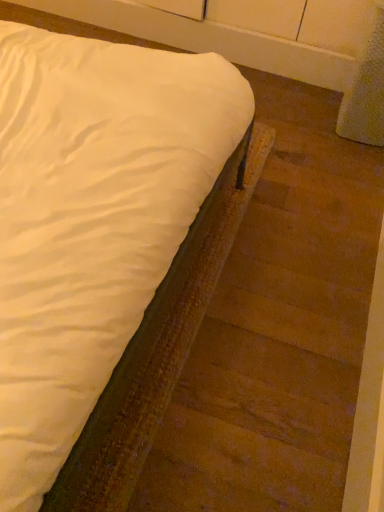
Image resolution: width=384 pixels, height=512 pixels. Describe the element at coordinates (158, 349) in the screenshot. I see `white fabric bed at center` at that location.

Image resolution: width=384 pixels, height=512 pixels. Identify the location of white fabric bed at center. (158, 349).

Where is `white fabric bed at center`? This screenshot has width=384, height=512. white fabric bed at center is located at coordinates (158, 349).